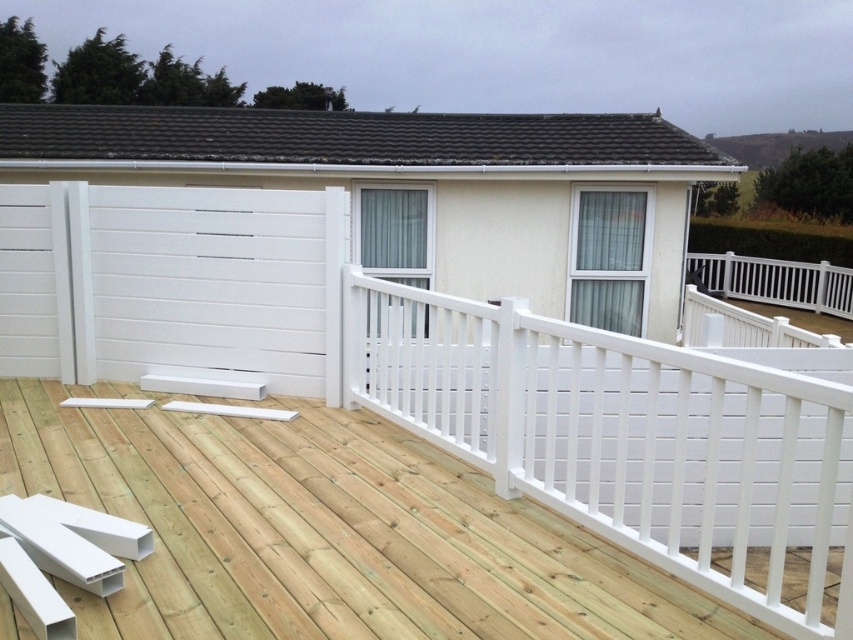
Question: Does natural wood deck at center appear on the left side of white painted wood rail at upper center?

Choices:
 (A) yes
 (B) no

Answer: (A)

Question: Is natural wood deck at center to the right of white painted wood rail at upper center from the viewer's perspective?

Choices:
 (A) yes
 (B) no

Answer: (B)

Question: Which point is farther to the camera?

Choices:
 (A) natural wood deck at center
 (B) white painted wood rail at upper center

Answer: (A)

Question: Does natural wood deck at center have a smaller size compared to white painted wood rail at upper center?

Choices:
 (A) yes
 (B) no

Answer: (A)